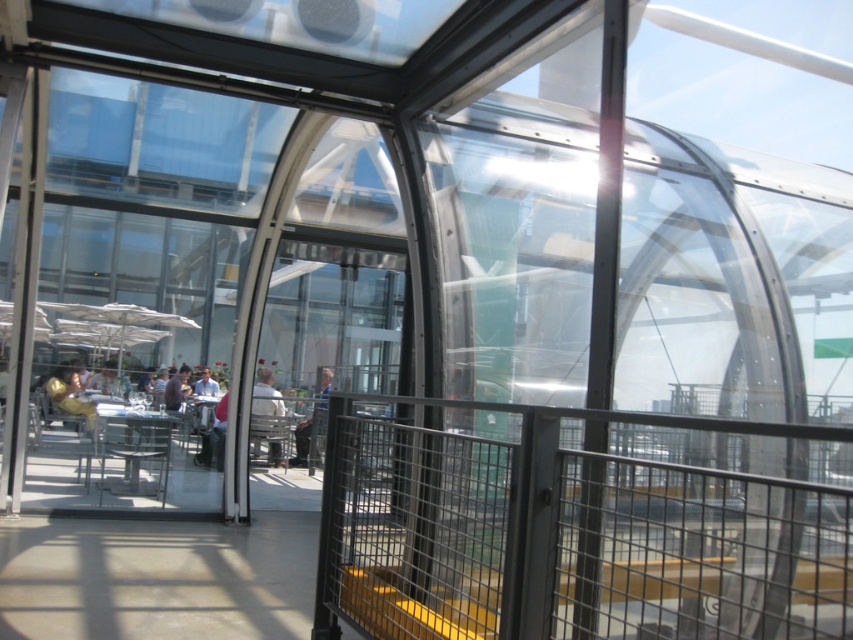
You are a customer entering the transparent glass door at center and want to greet the person wearing the golden yellow jacket at left. Which direction should you turn immediately after exiting the door to face them?

The transparent glass door at center is in front of the golden yellow jacket at left, so after exiting the door, you should turn to your left to face the person wearing the golden yellow jacket at left.